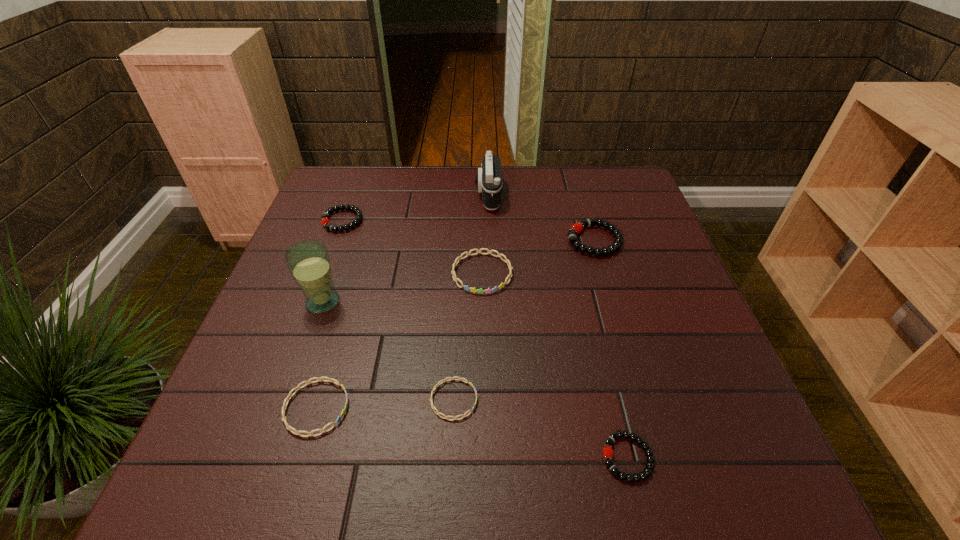
Where is `free spot that satisfies the following two spatial constraints: 1. on the surface of the leftmost blue bracelet showing star-shaped elements; 2. on the left side of the smallest black bracelet`? The height and width of the screenshot is (540, 960). free spot that satisfies the following two spatial constraints: 1. on the surface of the leftmost blue bracelet showing star-shaped elements; 2. on the left side of the smallest black bracelet is located at coordinates (301, 457).